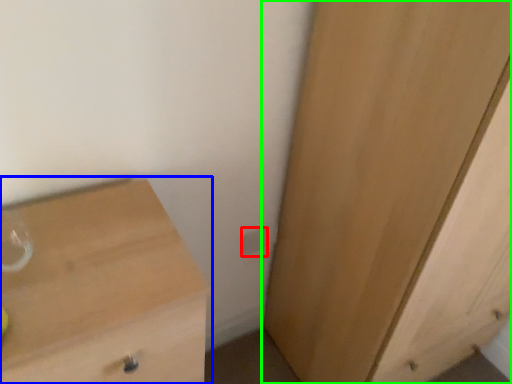
Question: Which object is the closest to the electric outlet (highlighted by a red box)? Choose among these: chest of drawers (highlighted by a blue box) or cupboard (highlighted by a green box).

Choices:
 (A) chest of drawers
 (B) cupboard

Answer: (B)